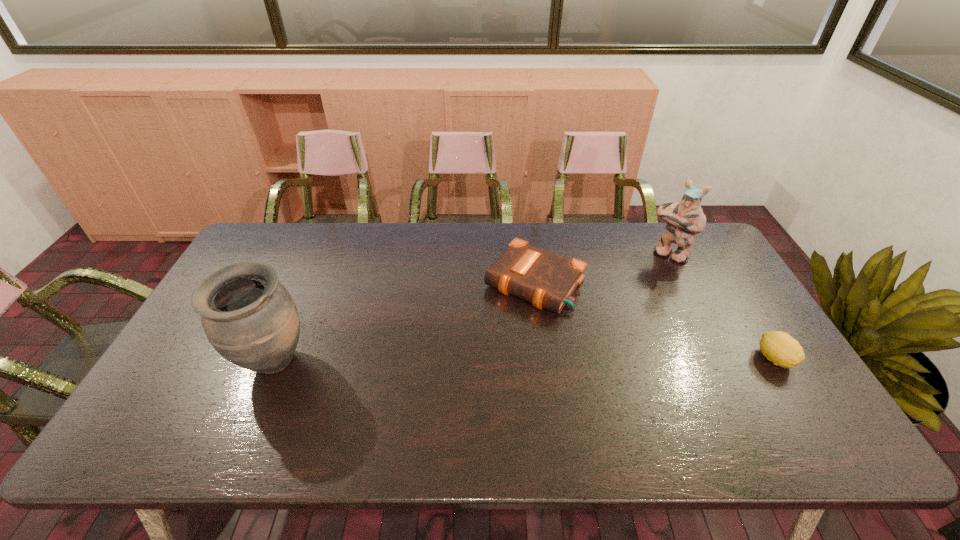
You are a GUI agent. You are given a task and a screenshot of the screen. Output one action in this format:
    pyautogui.click(x=<x>, y=<y>)
    Task: Click on the free spot on the desktop that is between the urn and the lemon and is positioned on the spine side of the Bible
    The height and width of the screenshot is (540, 960).
    Given the screenshot: What is the action you would take?
    pyautogui.click(x=475, y=361)

The image size is (960, 540). Identify the location of vacant space on the desktop that is between the leftmost object and the lemon and is positioned on the front-facing side of the second object from right to left. (582, 360).